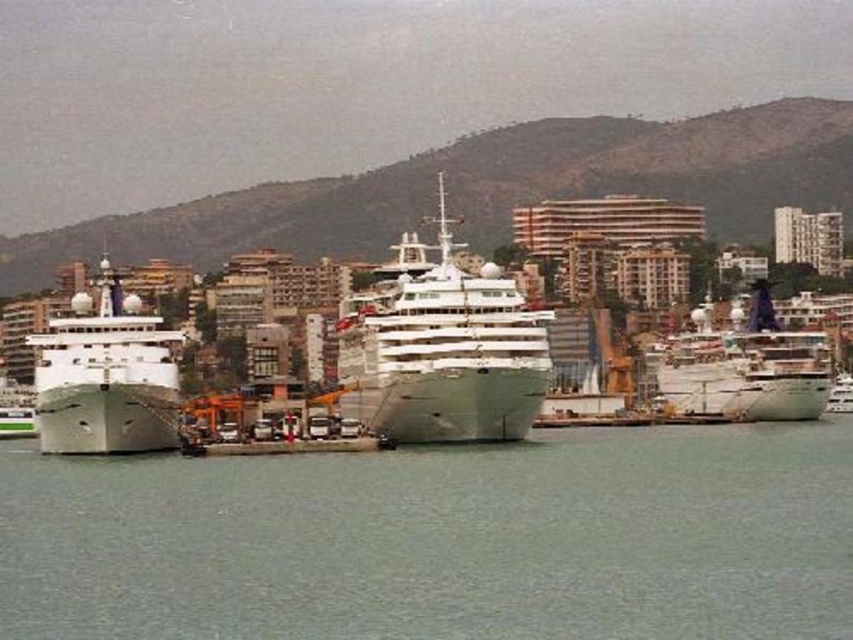
From the picture: Is green matte ship at left to the left of white glossy ship at right from the viewer's perspective?

Correct, you'll find green matte ship at left to the left of white glossy ship at right.

Is green matte ship at left above white glossy ship at right?

Indeed, green matte ship at left is positioned over white glossy ship at right.

Is point (126, 424) less distant than point (747, 330)?

Yes, it is in front of point (747, 330).

Locate an element on the screen. This screenshot has width=853, height=640. green matte ship at left is located at coordinates (106, 376).

Can you confirm if white glossy cruise ship at center is smaller than white glossy ship at right?

No, white glossy cruise ship at center is not smaller than white glossy ship at right.

Does point (491, 348) come closer to viewer compared to point (769, 371)?

Yes, point (491, 348) is closer to viewer.

Locate an element on the screen. Image resolution: width=853 pixels, height=640 pixels. white glossy cruise ship at center is located at coordinates (440, 348).

Consider the image. Does green water at center appear over white glossy cruise ship at center?

Actually, green water at center is below white glossy cruise ship at center.

Is green water at center taller than white glossy cruise ship at center?

In fact, green water at center may be shorter than white glossy cruise ship at center.

Is point (494, 522) behind point (415, 337)?

That is False.

I want to click on green water at center, so click(440, 540).